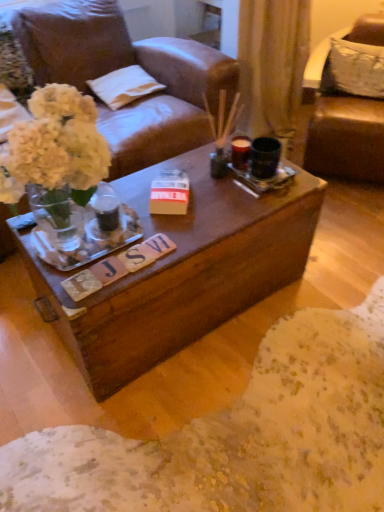
Question: Could you tell me if brown leather chair at upper right is turned towards white cotton pillow at upper center, the 2th pillow viewed from the right?

Choices:
 (A) yes
 (B) no

Answer: (B)

Question: From the image's perspective, does brown leather chair at upper right appear lower than white cotton pillow at upper center, which appears as the 1th pillow when viewed from the left?

Choices:
 (A) yes
 (B) no

Answer: (A)

Question: Does brown leather chair at upper right have a larger size compared to white cotton pillow at upper center, which appears as the 1th pillow when viewed from the left?

Choices:
 (A) no
 (B) yes

Answer: (B)

Question: Is brown leather chair at upper right oriented away from white cotton pillow at upper center, the 2th pillow viewed from the right?

Choices:
 (A) yes
 (B) no

Answer: (B)

Question: Can you confirm if brown leather chair at upper right is taller than white cotton pillow at upper center, which appears as the 1th pillow when viewed from the left?

Choices:
 (A) yes
 (B) no

Answer: (A)

Question: From their relative heights in the image, would you say brown leather chair at upper right is taller or shorter than white fabric pillow at upper right, the first pillow viewed from the right?

Choices:
 (A) short
 (B) tall

Answer: (B)

Question: Is brown leather chair at upper right bigger or smaller than white fabric pillow at upper right, acting as the second pillow starting from the left?

Choices:
 (A) big
 (B) small

Answer: (A)

Question: Choose the correct answer: Is brown leather chair at upper right inside white fabric pillow at upper right, the first pillow viewed from the right, or outside it?

Choices:
 (A) inside
 (B) outside

Answer: (B)

Question: From the image's perspective, is brown leather chair at upper right positioned above or below white fabric pillow at upper right, the first pillow viewed from the right?

Choices:
 (A) above
 (B) below

Answer: (B)

Question: In terms of width, does white cotton pillow at upper center, which appears as the 1th pillow when viewed from the left, look wider or thinner when compared to brown leather chair at upper right?

Choices:
 (A) wide
 (B) thin

Answer: (B)

Question: From a real-world perspective, is white cotton pillow at upper center, which appears as the 1th pillow when viewed from the left, above or below brown leather chair at upper right?

Choices:
 (A) above
 (B) below

Answer: (A)

Question: From the image's perspective, is white cotton pillow at upper center, the 2th pillow viewed from the right, positioned above or below brown leather chair at upper right?

Choices:
 (A) below
 (B) above

Answer: (B)

Question: Which is correct: white cotton pillow at upper center, which appears as the 1th pillow when viewed from the left, is inside brown leather chair at upper right, or outside of it?

Choices:
 (A) outside
 (B) inside

Answer: (A)

Question: In the image, is white cotton pillow at upper center, which appears as the 1th pillow when viewed from the left, on the left side or the right side of white fabric pillow at upper right, acting as the second pillow starting from the left?

Choices:
 (A) left
 (B) right

Answer: (A)

Question: Is white cotton pillow at upper center, the 2th pillow viewed from the right, in front of or behind white fabric pillow at upper right, acting as the second pillow starting from the left, in the image?

Choices:
 (A) front
 (B) behind

Answer: (B)